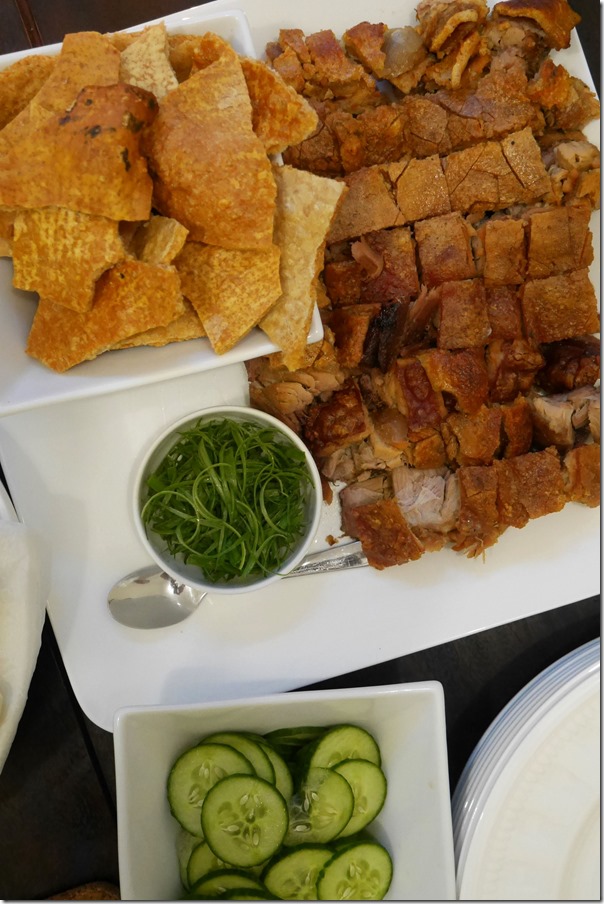
What are the coordinates of `spoon handle` in the screenshot? It's located at (355, 560).